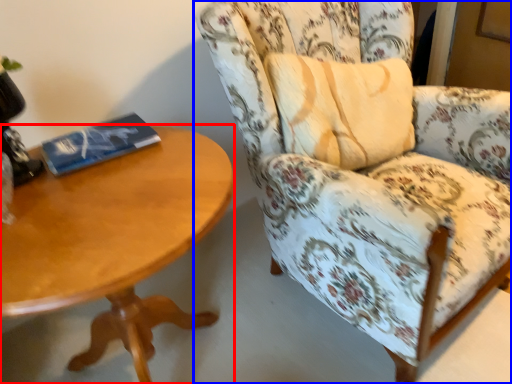
Question: Which object appears farthest to the camera in this image, coffee table (highlighted by a red box) or chair (highlighted by a blue box)?

Choices:
 (A) coffee table
 (B) chair

Answer: (B)